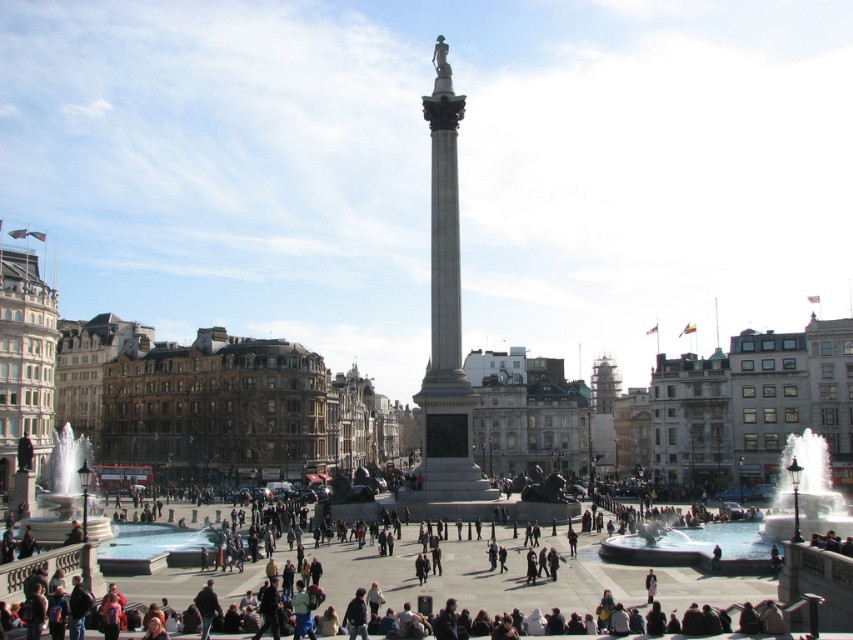
Based on the photo, you are standing at the center of Trafalgar Square, facing Nelsons Column. You want to find the shiny metallic fountain at lower right. Which direction should you turn to face it?

The shiny metallic fountain at lower right is located at point (749, 522), which is to the lower right direction from the center. So you should turn to your right and look downward to face the shiny metallic fountain at lower right.

You are standing in Trafalgar Square facing Nelsons Column. You see two points marked on the ground in front of you. The first point is at coordinate (432, 403) and the second point is at coordinate (45, 524). If you want to place a small flowerpot on the point that is closer to you, which coordinate should you choose?

Point (45, 524) is closer to you than point (432, 403), so you should place the flowerpot there.